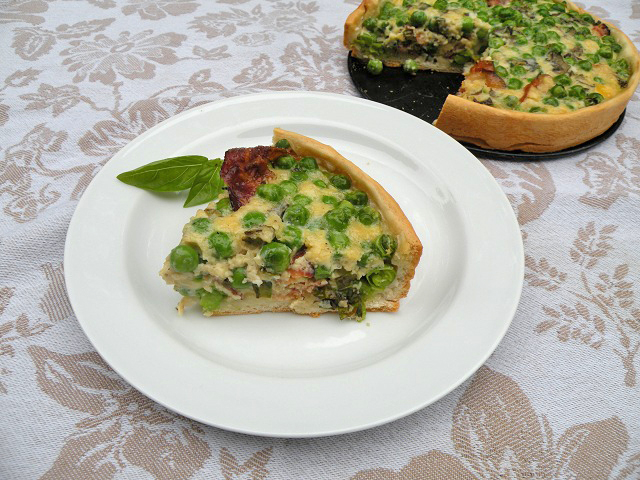
Where is `tablecloth`? This screenshot has width=640, height=480. tablecloth is located at coordinates (572, 371).